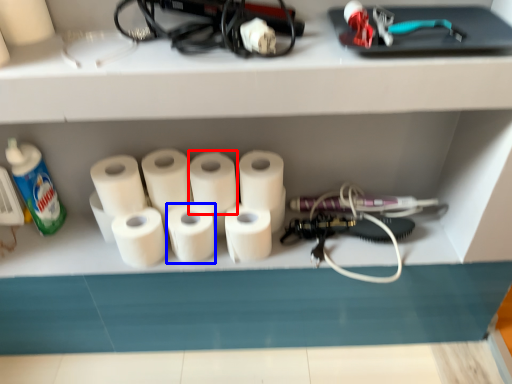
Question: Which object appears farthest to the camera in this image, toilet paper (highlighted by a red box) or paper towel (highlighted by a blue box)?

Choices:
 (A) toilet paper
 (B) paper towel

Answer: (B)